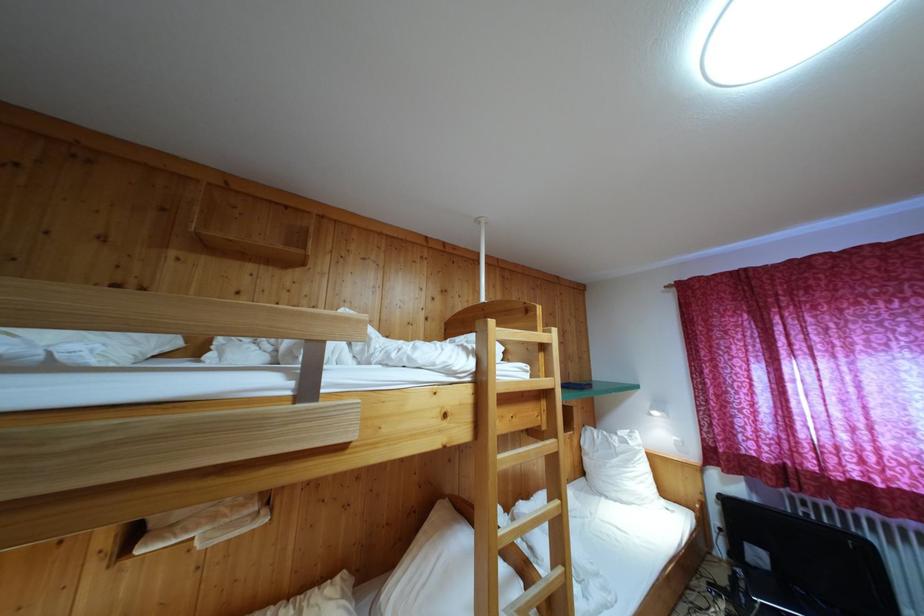
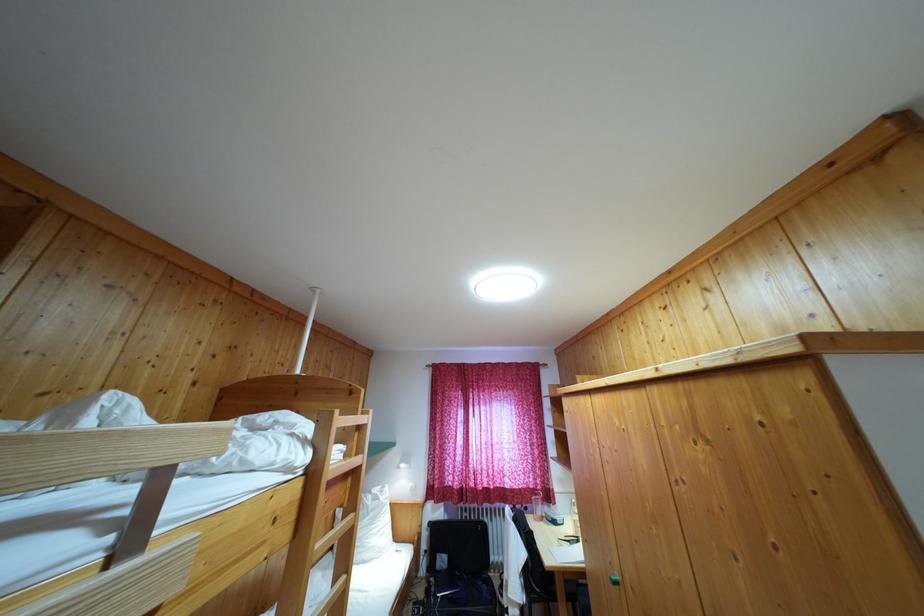
Where in the second image is the point corresponding to point (483, 387) from the first image?

(317, 479)